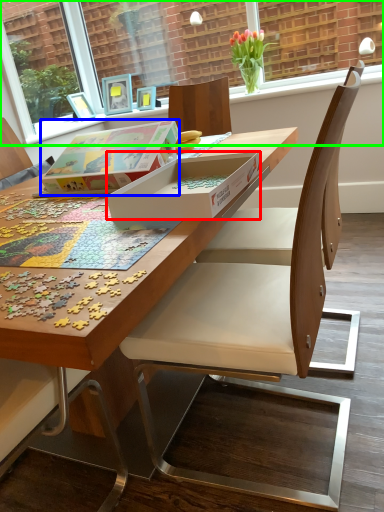
Question: Which is farther away from box (highlighted by a red box)? box (highlighted by a blue box) or window screen (highlighted by a green box)?

Choices:
 (A) box
 (B) window screen

Answer: (B)